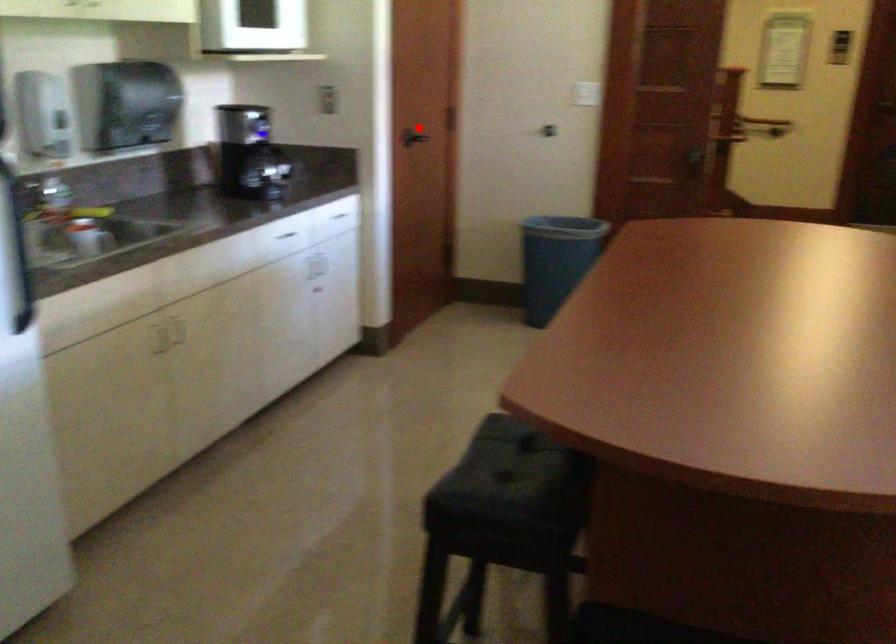
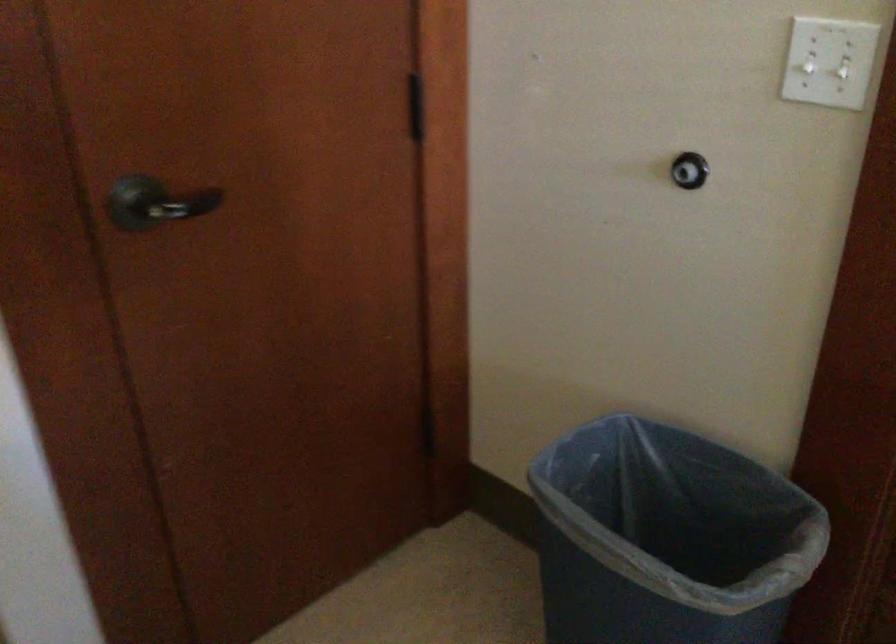
Question: I am providing you with two images of the same scene from different viewpoints. Image1 has a red point marked. In image2, the corresponding 3D location appears at what relative position? Reply with the corresponding letter.

Choices:
 (A) Closer
 (B) Farther

Answer: (A)